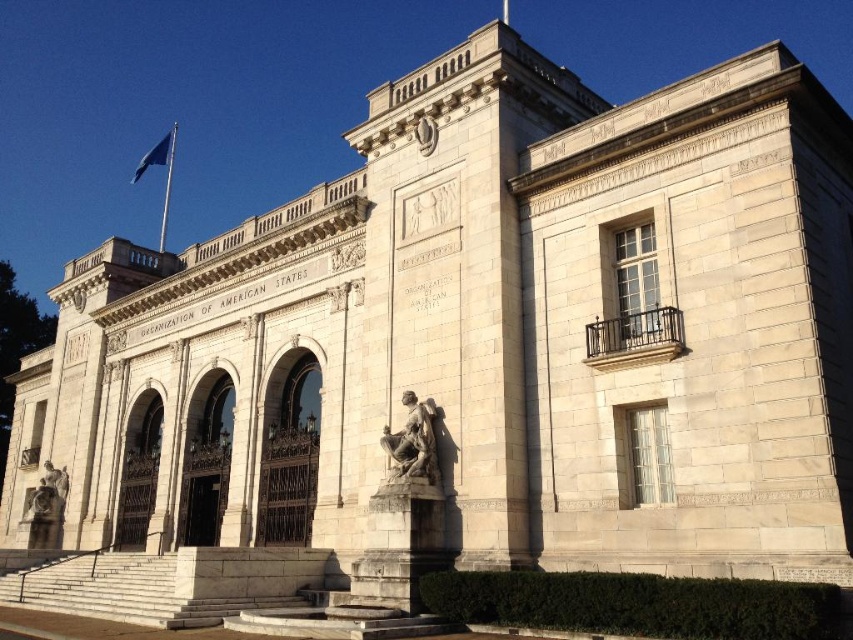
Question: Which point is farther from the camera taking this photo?

Choices:
 (A) (44, 493)
 (B) (165, 148)

Answer: (B)

Question: Is bronze statue at lower left positioned before blue fabric flag at upper left?

Choices:
 (A) yes
 (B) no

Answer: (A)

Question: In this image, where is bronze statue at lower left located relative to blue fabric flag at upper left?

Choices:
 (A) below
 (B) above

Answer: (A)

Question: Among these points, which one is nearest to the camera?

Choices:
 (A) (65, 488)
 (B) (152, 157)

Answer: (A)

Question: Is bronze statue at lower left smaller than blue fabric flag at upper left?

Choices:
 (A) no
 (B) yes

Answer: (B)